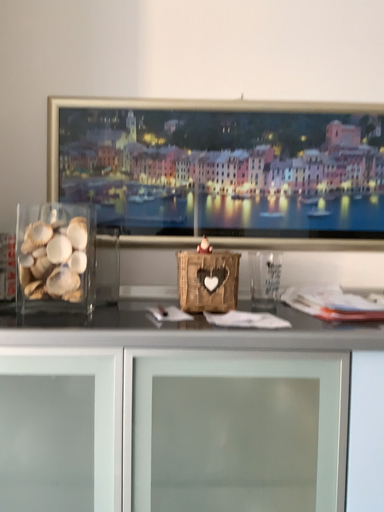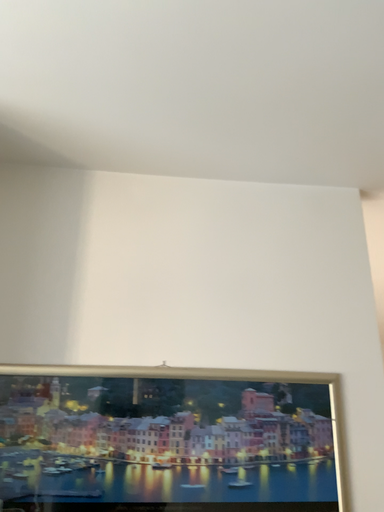
Question: Which way did the camera rotate in the video?

Choices:
 (A) rotated left
 (B) rotated right

Answer: (B)